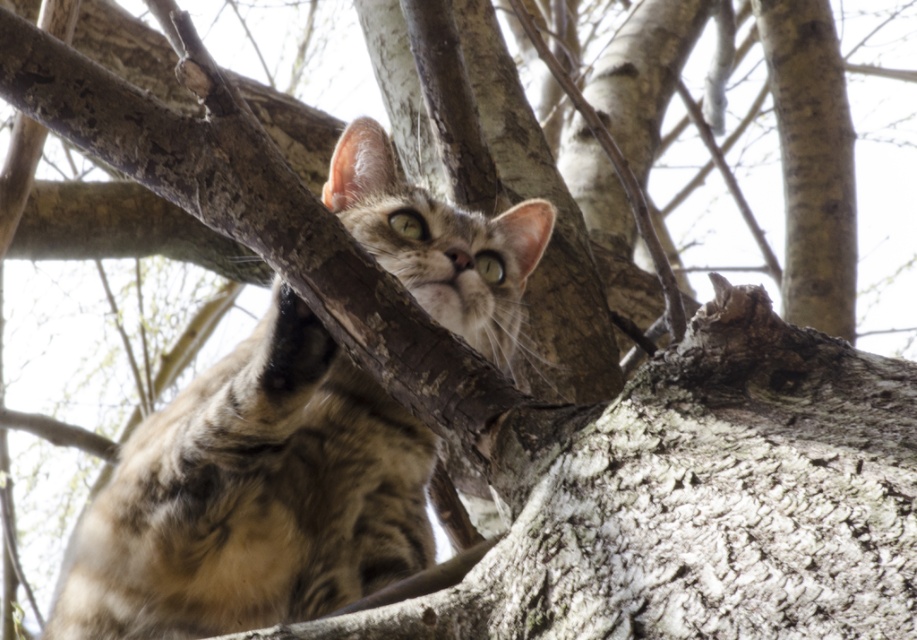
Based on the coordinates provided in the image, where exactly is the tabby fur cat at center located?

The tabby fur cat at center is located at point [253,497].

You are a wildlife photographer trying to capture a clear photo of the tabby fur cat at center and the smooth gray bark at upper right. Based on their sizes in the image, which one will appear larger in your photo?

The tabby fur cat at center will appear larger in the photo because it is bigger than the smooth gray bark at upper right.

You are a wildlife photographer trying to capture the tabby fur cat at center and the smooth gray bark at upper right in the same frame. Based on their sizes, which object would appear larger in your photo?

The tabby fur cat at center would appear larger in the photo since its width surpasses that of the smooth gray bark at upper right.